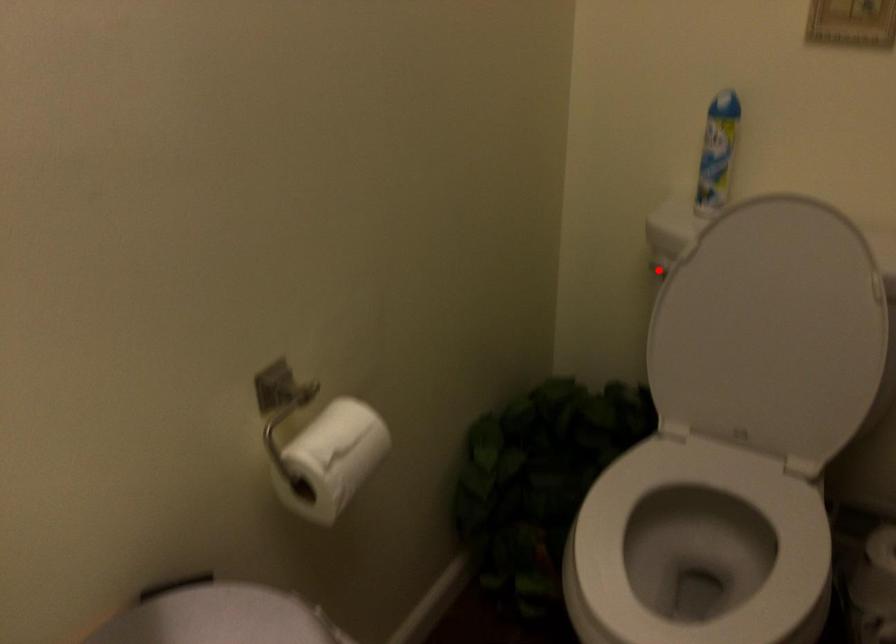
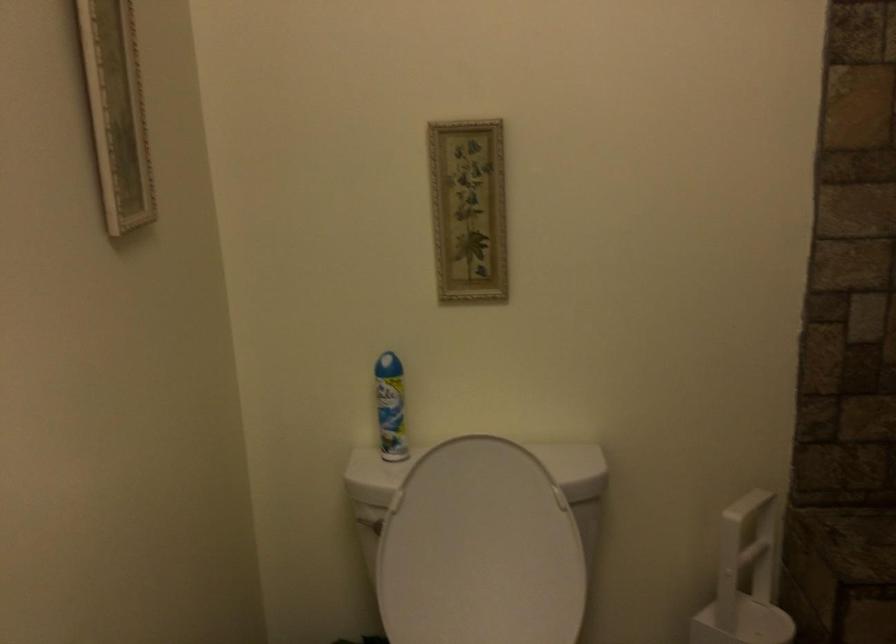
Question: I am providing you with two images of the same scene from different viewpoints. A red point is marked on the first image. Is the red point's position out of view in image 2?

Choices:
 (A) Yes
 (B) No

Answer: (B)